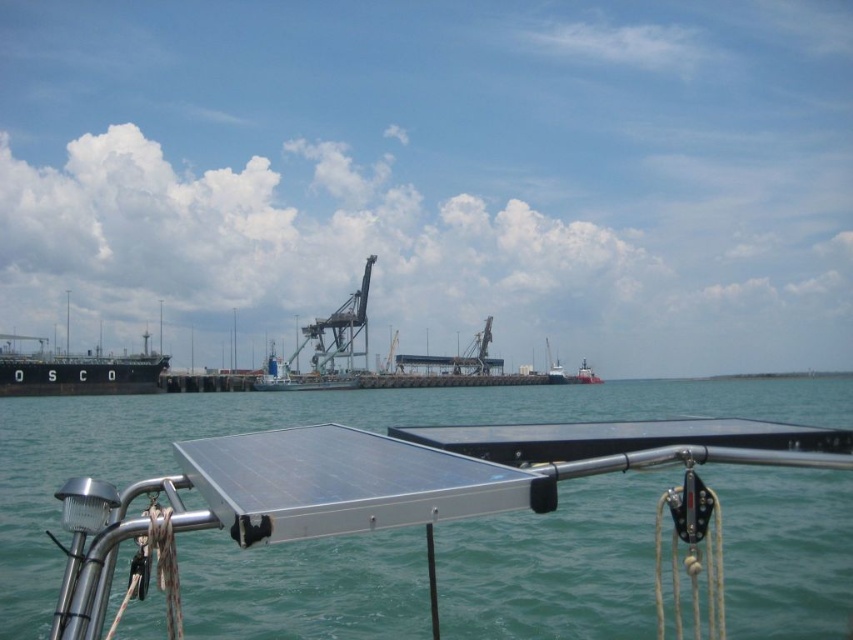
Consider the image. You are a dock worker trying to direct a tugboat to the metallic gray crane at center. You see the black matte ship at left blocking the path. Which direction should you move the tugboat to reach the crane?

The black matte ship at left is to the left of the metallic gray crane at center, so you should move the tugboat to the right to bypass the ship and reach the crane.

You are a sailor on a boat and need to navigate between the metallic blue water at center and the black matte ship at left. Which object is closer to the horizon?

The black matte ship at left is closer to the horizon because the metallic blue water at center is shorter than it.